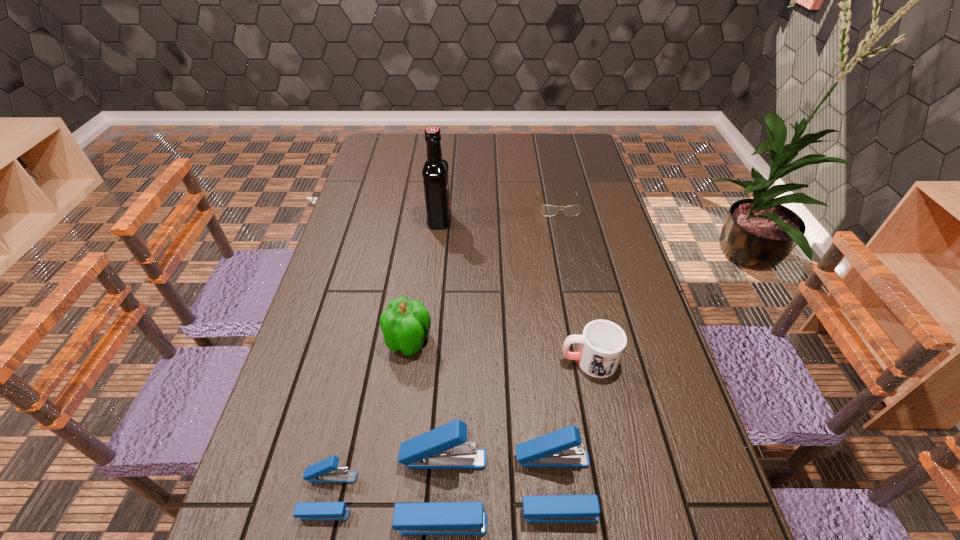
At what (x,y) coordinates should I click in order to perform the action: click on mug at the right edge. Please return your answer as a coordinate pair (x, y). This screenshot has height=540, width=960. Looking at the image, I should click on (602, 343).

This screenshot has width=960, height=540. Find the location of `object that is at the near left corner`. object that is at the near left corner is located at coordinates (325, 471).

Identify the location of vacant space at the far edge of the desktop. The height and width of the screenshot is (540, 960). (540, 134).

The height and width of the screenshot is (540, 960). In the image, there is a desktop. In order to click on blank space at the left edge in this screenshot , I will do `click(347, 387)`.

In the image, there is a desktop. Identify the location of vacant space at the far left corner. Image resolution: width=960 pixels, height=540 pixels. (388, 152).

The width and height of the screenshot is (960, 540). Identify the location of free space at the near left corner of the desktop. (278, 493).

The width and height of the screenshot is (960, 540). Identify the location of vacant space at the near right corner of the desktop. (698, 474).

Identify the location of free space between the shortest object and the second stapler from right to left. The width and height of the screenshot is (960, 540). tap(500, 348).

You are a GUI agent. You are given a task and a screenshot of the screen. Output one action in this format:
    pyautogui.click(x=<x>, y=<y>)
    Task: Click on the empty space that is in between the bell pepper and the tallest object
    This screenshot has height=540, width=960.
    Given the screenshot: What is the action you would take?
    pyautogui.click(x=424, y=281)

Identify the location of free space that is in between the second stapler from right to left and the shortest stapler. The height and width of the screenshot is (540, 960). (385, 493).